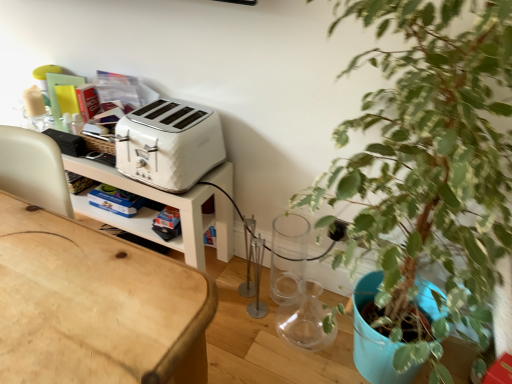
This screenshot has width=512, height=384. Describe the element at coordinates (169, 144) in the screenshot. I see `white plastic toaster at upper center` at that location.

Identify the location of white plastic toaster at upper center. The width and height of the screenshot is (512, 384). (169, 144).

This screenshot has height=384, width=512. What do you see at coordinates (429, 162) in the screenshot? I see `green leafy plant at right` at bounding box center [429, 162].

Where is `green leafy plant at right`? The height and width of the screenshot is (384, 512). green leafy plant at right is located at coordinates (429, 162).

The width and height of the screenshot is (512, 384). Identify the location of white plastic toaster at upper center. (x=169, y=144).

Does green leafy plant at right appear on the left side of white plastic toaster at upper center?

In fact, green leafy plant at right is to the right of white plastic toaster at upper center.

Is the depth of green leafy plant at right greater than that of white plastic toaster at upper center?

No, the depth of green leafy plant at right is less than that of white plastic toaster at upper center.

Considering the points (418, 88) and (167, 135), which point is behind, point (418, 88) or point (167, 135)?

The point (167, 135) is farther.

From the image's perspective, is green leafy plant at right above or below white plastic toaster at upper center?

Clearly, from the image's perspective, green leafy plant at right is below white plastic toaster at upper center.

From a real-world perspective, is green leafy plant at right located higher than white plastic toaster at upper center?

Incorrect, from a real-world perspective, green leafy plant at right is lower than white plastic toaster at upper center.

Considering the relative sizes of green leafy plant at right and white plastic toaster at upper center in the image provided, is green leafy plant at right thinner than white plastic toaster at upper center?

Incorrect, the width of green leafy plant at right is not less than that of white plastic toaster at upper center.

Is green leafy plant at right taller or shorter than white plastic toaster at upper center?

Considering their sizes, green leafy plant at right has more height than white plastic toaster at upper center.

Considering the sizes of green leafy plant at right and white plastic toaster at upper center in the image, is green leafy plant at right bigger or smaller than white plastic toaster at upper center?

In the image, green leafy plant at right appears to be larger than white plastic toaster at upper center.

Looking at this image, can white plastic toaster at upper center be found inside green leafy plant at right?

No, white plastic toaster at upper center is not inside green leafy plant at right.

Consider the image. Is green leafy plant at right beside white plastic toaster at upper center?

green leafy plant at right and white plastic toaster at upper center are clearly separated.

Is green leafy plant at right positioned with its back to white plastic toaster at upper center?

green leafy plant at right is not turned away from white plastic toaster at upper center.

In order to click on houseplant below the white plastic toaster at upper center (from the image's perspective) in this screenshot , I will do point(429,162).

Which object is positioned more to the left, white plastic toaster at upper center or green leafy plant at right?

From the viewer's perspective, white plastic toaster at upper center appears more on the left side.

Is white plastic toaster at upper center in front of or behind green leafy plant at right in the image?

In the image, white plastic toaster at upper center appears behind green leafy plant at right.

Considering the points (128, 147) and (459, 58), which point is behind, point (128, 147) or point (459, 58)?

The point (128, 147) is farther from the camera.

From the image's perspective, is white plastic toaster at upper center located above green leafy plant at right?

Yes.

From a real-world perspective, is white plastic toaster at upper center positioned under green leafy plant at right based on gravity?

Incorrect, from a real-world perspective, white plastic toaster at upper center is higher than green leafy plant at right.

Is white plastic toaster at upper center wider or thinner than green leafy plant at right?

Clearly, white plastic toaster at upper center has less width compared to green leafy plant at right.

Which of these two, white plastic toaster at upper center or green leafy plant at right, stands taller?

Standing taller between the two is green leafy plant at right.

Considering the sizes of objects white plastic toaster at upper center and green leafy plant at right in the image provided, who is smaller, white plastic toaster at upper center or green leafy plant at right?

white plastic toaster at upper center.

From the picture: Is white plastic toaster at upper center situated inside green leafy plant at right or outside?

white plastic toaster at upper center exists outside the volume of green leafy plant at right.

Are white plastic toaster at upper center and green leafy plant at right making contact?

No, white plastic toaster at upper center is not in contact with green leafy plant at right.

Could you tell me if white plastic toaster at upper center is turned towards green leafy plant at right?

No, white plastic toaster at upper center is not facing towards green leafy plant at right.

What's the angular difference between white plastic toaster at upper center and green leafy plant at right's facing directions?

3.68 degrees separate the facing orientations of white plastic toaster at upper center and green leafy plant at right.

Where is `houseplant on the right of white plastic toaster at upper center`? This screenshot has height=384, width=512. houseplant on the right of white plastic toaster at upper center is located at coordinates (429, 162).

Find the location of a particular element. The image size is (512, 384). houseplant located below the white plastic toaster at upper center (from the image's perspective) is located at coordinates (429, 162).

The image size is (512, 384). Find the location of `houseplant in front of the white plastic toaster at upper center`. houseplant in front of the white plastic toaster at upper center is located at coordinates point(429,162).